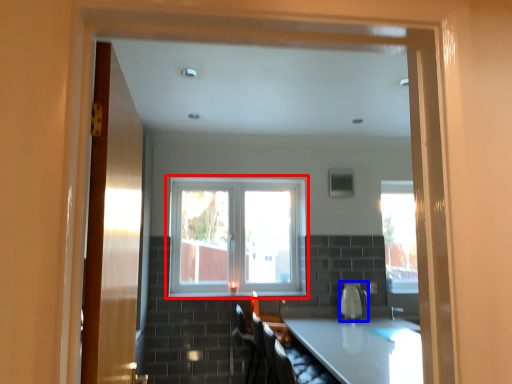
Question: Which of the following is the farthest to the observer, window (highlighted by a red box) or appliance (highlighted by a blue box)?

Choices:
 (A) window
 (B) appliance

Answer: (A)